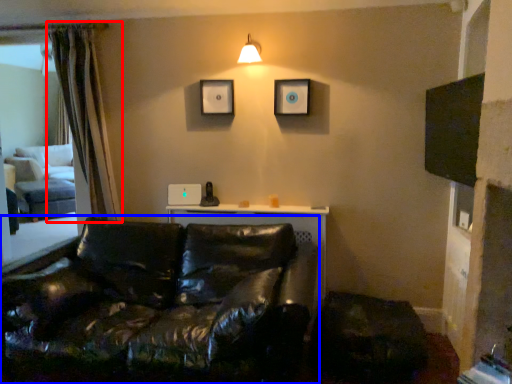
Question: Which of the following is the closest to the observer, curtain (highlighted by a red box) or studio couch (highlighted by a blue box)?

Choices:
 (A) curtain
 (B) studio couch

Answer: (B)